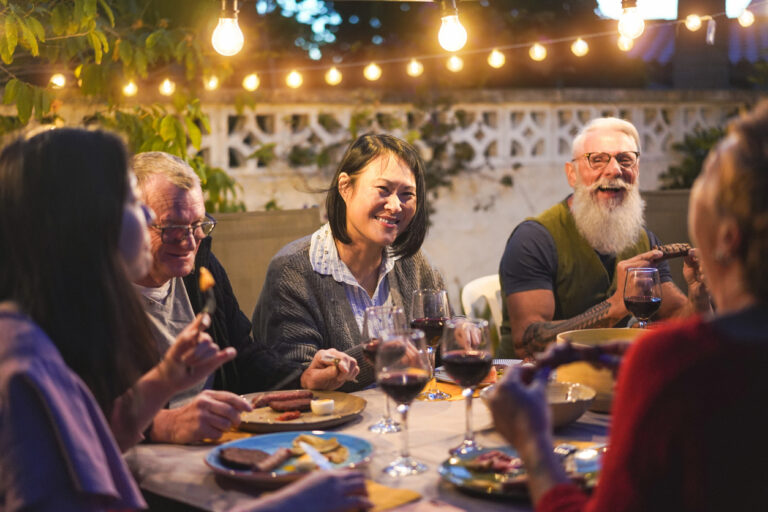
What are the coordinates of `wine glasses` in the screenshot? It's located at (416, 364), (382, 322), (422, 305), (471, 333), (643, 294).